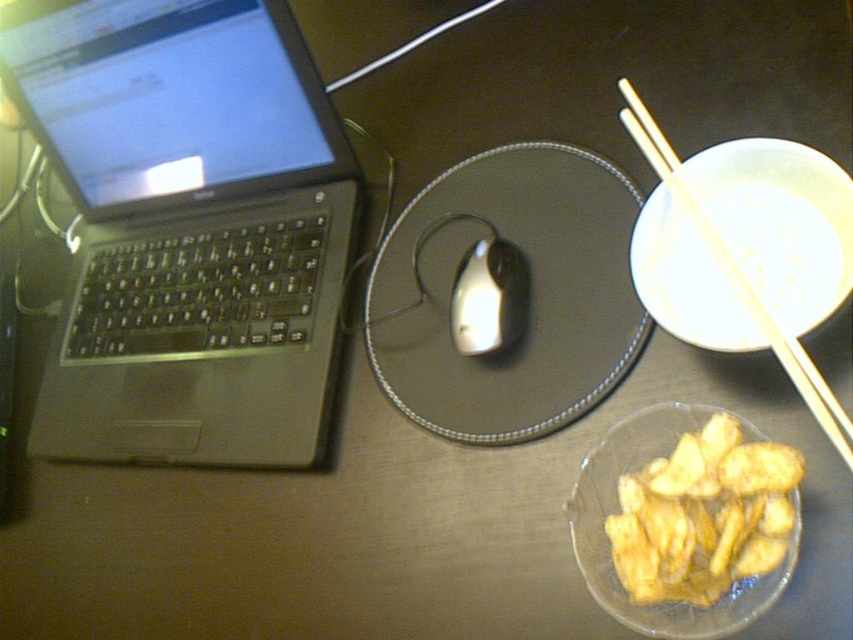
Question: Is wooden chopsticks at upper right smaller than shiny metallic mouse at center?

Choices:
 (A) yes
 (B) no

Answer: (B)

Question: Is satin black laptop at left bigger than glossy plastic mouse pad at center?

Choices:
 (A) no
 (B) yes

Answer: (B)

Question: Which of the following is the farthest from the observer?

Choices:
 (A) (549, 243)
 (B) (726, 259)

Answer: (A)

Question: Which point appears closest to the camera in this image?

Choices:
 (A) (653, 148)
 (B) (483, 385)
 (C) (271, 308)
 (D) (654, 538)

Answer: (D)

Question: Does satin black laptop at left appear over shiny metallic mouse at center?

Choices:
 (A) yes
 (B) no

Answer: (A)

Question: Which of these objects is positioned closest to the glossy plastic mouse pad at center?

Choices:
 (A) satin black laptop at left
 (B) golden crispy chips at lower right
 (C) shiny metallic mouse at center
 (D) wooden chopsticks at upper right

Answer: (C)